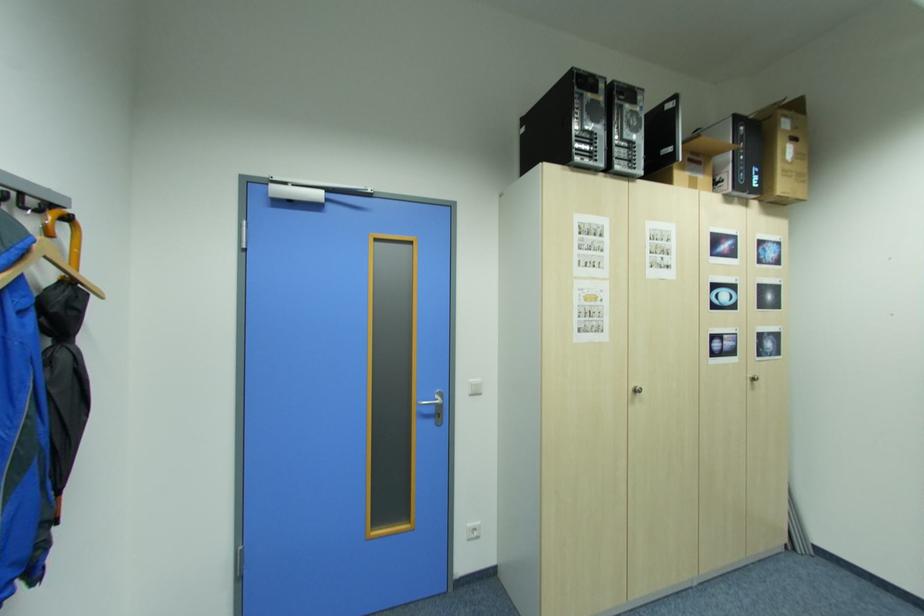
Find where to lift the wooden clothes hanger. Please return your answer as a coordinate pair (x, y).

(47, 265)